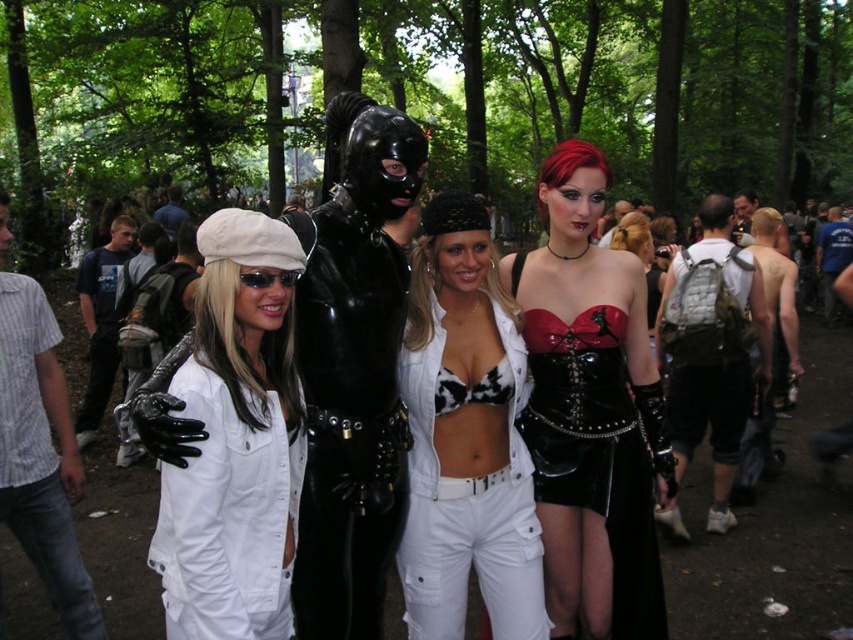
Is point (631, 557) closer to viewer compared to point (157, 528)?

That is False.

Where is `shiny black corset at center`? shiny black corset at center is located at coordinates (590, 412).

Locate an element on the screen. The height and width of the screenshot is (640, 853). shiny black corset at center is located at coordinates (590, 412).

Is white matte jumpsuit at center wider than matte black corset at center?

No, white matte jumpsuit at center is not wider than matte black corset at center.

Between point (166, 528) and point (654, 268), which one is positioned in front?

Point (166, 528) is in front.

Identify the location of white matte jumpsuit at center. (235, 440).

Which is above, shiny black corset at center or cow print bra at center?

shiny black corset at center

Between point (625, 556) and point (519, 524), which one is positioned behind?

Positioned behind is point (625, 556).

Image resolution: width=853 pixels, height=640 pixels. I want to click on shiny black corset at center, so click(x=590, y=412).